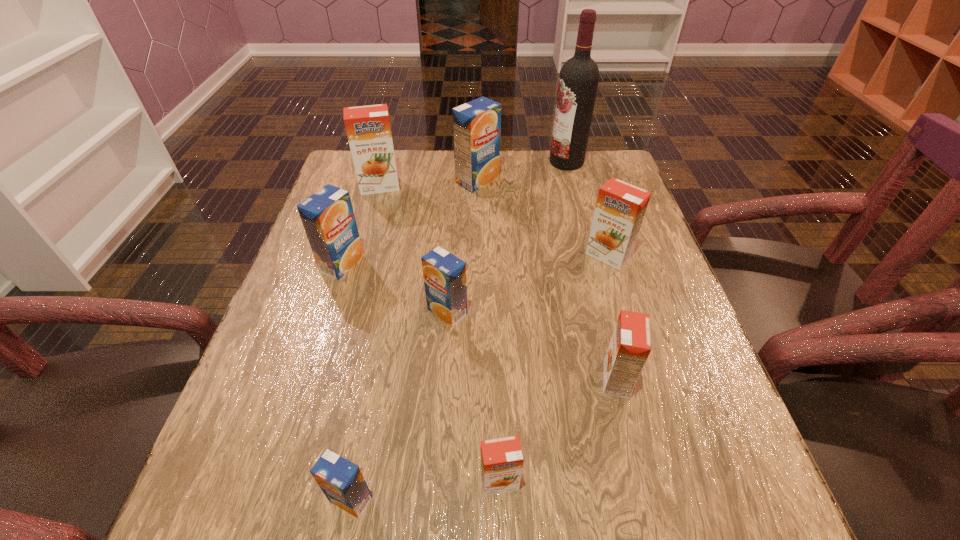
Find the location of `wine bottle`. wine bottle is located at coordinates (578, 80).

Locate an element on the screen. the farthest blue orange_juice is located at coordinates pos(476,124).

Find the location of `the leftmost orange orange juice`. the leftmost orange orange juice is located at coordinates (368, 129).

Identify the location of the biggest orange orange juice. [x=368, y=129].

Locate an element on the screen. The image size is (960, 540). the second farthest blue orange_juice is located at coordinates (328, 218).

Locate an element on the screen. the leftmost blue orange_juice is located at coordinates (328, 218).

Where is `the third nearest orange orange juice`? This screenshot has height=540, width=960. the third nearest orange orange juice is located at coordinates (620, 208).

Where is `the third biggest blue orange_juice`? The height and width of the screenshot is (540, 960). the third biggest blue orange_juice is located at coordinates (444, 274).

Identify the location of the sixth farthest object. (444, 274).

At what (x,y) coordinates should I click in order to perform the action: click on the sixth farthest orange juice. Please return your answer as a coordinate pair (x, y). This screenshot has height=540, width=960. Looking at the image, I should click on (630, 345).